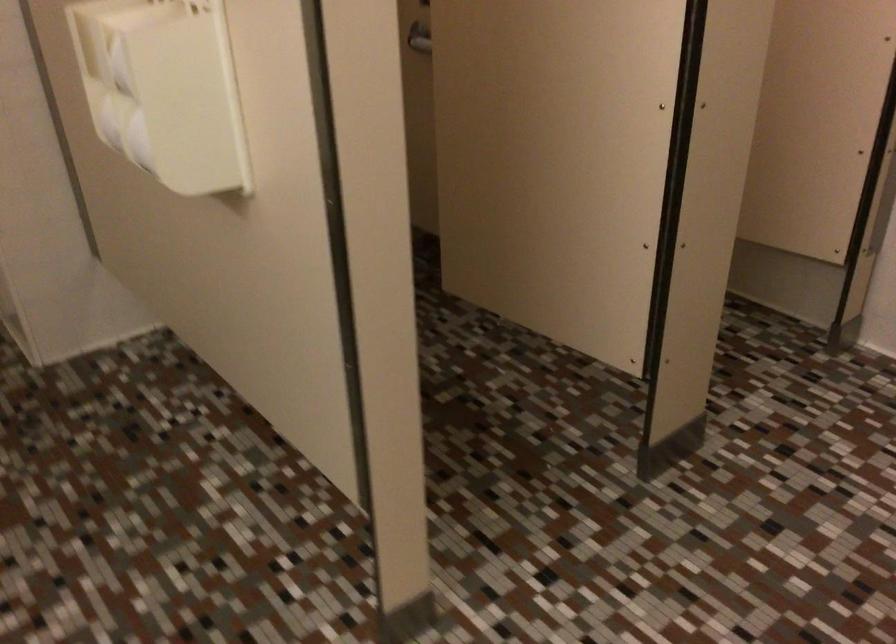
Locate an element on the screen. white toilet paper is located at coordinates (164, 90).